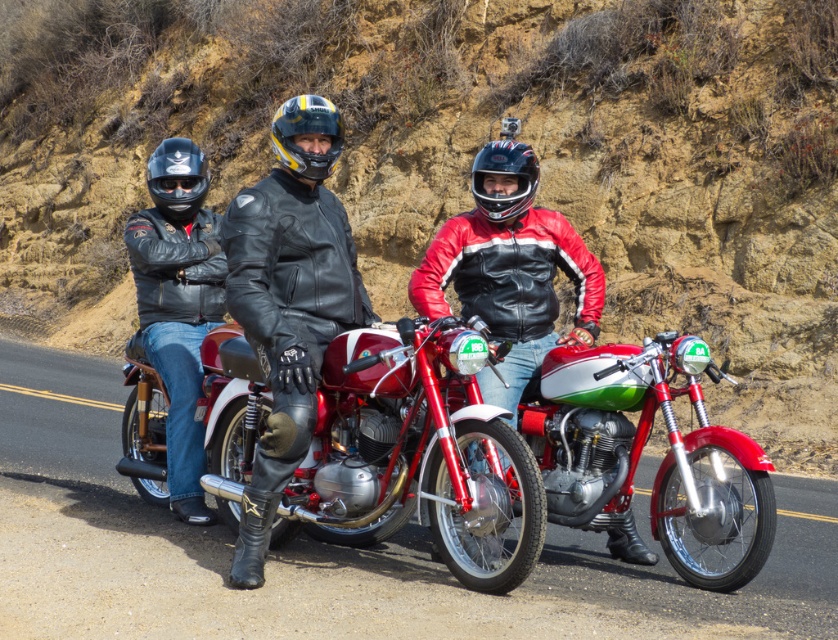
You are standing in front of the riders and want to place a small flag exactly halfway between the two points marked as point (185, 371) and point (169, 180). Which direction should you move from the central point to ensure the flag is correctly placed?

Since point (185, 371) is closer to you than point (169, 180), the halfway point would be closer to the point that is farther away. Therefore, you should move the flag slightly toward point (169, 180) from the central point to ensure it is correctly placed.